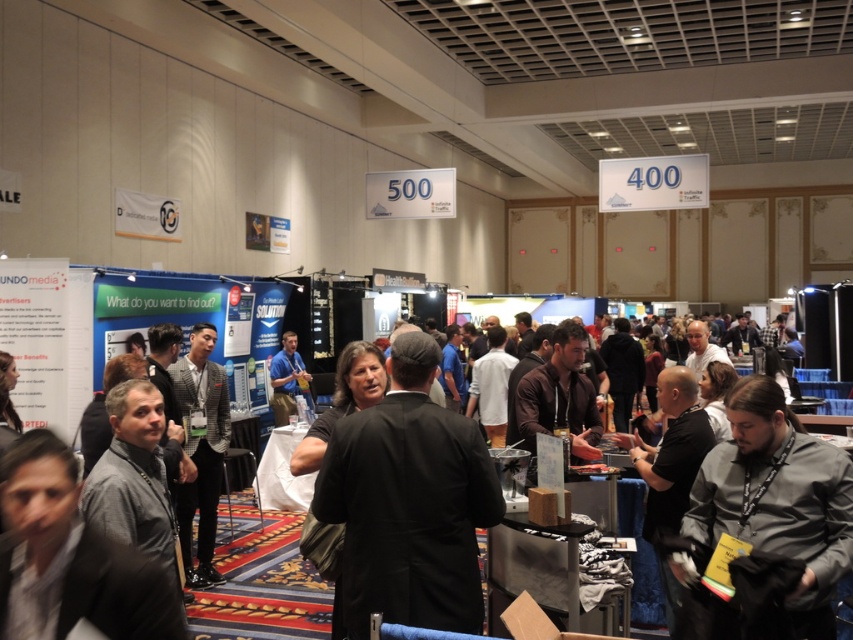
Between black suit at center and gray fabric shirt at lower right, which one appears on the left side from the viewer's perspective?

black suit at center

Is point (372, 582) positioned behind point (753, 512)?

Yes, point (372, 582) is behind point (753, 512).

Locate an element on the screen. Image resolution: width=853 pixels, height=640 pixels. black suit at center is located at coordinates (409, 502).